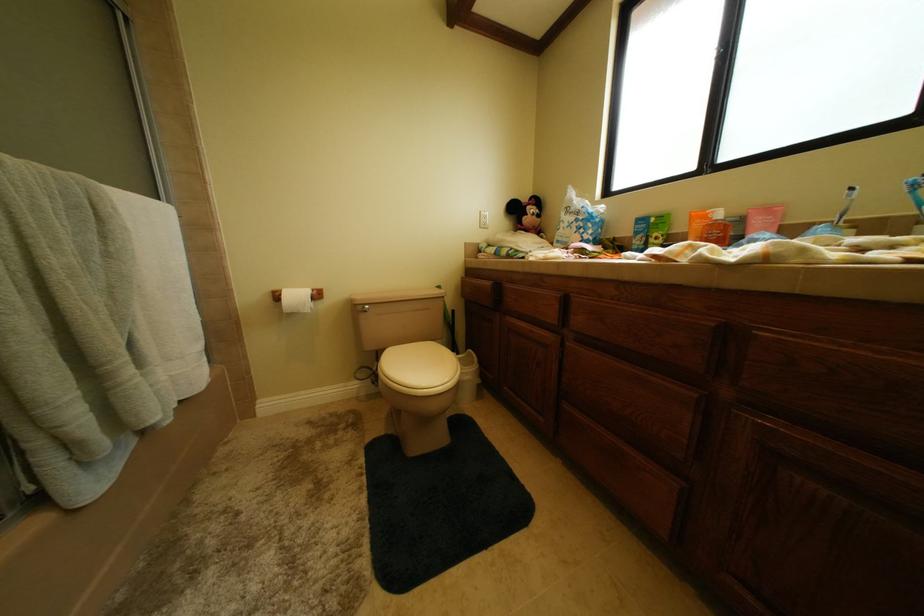
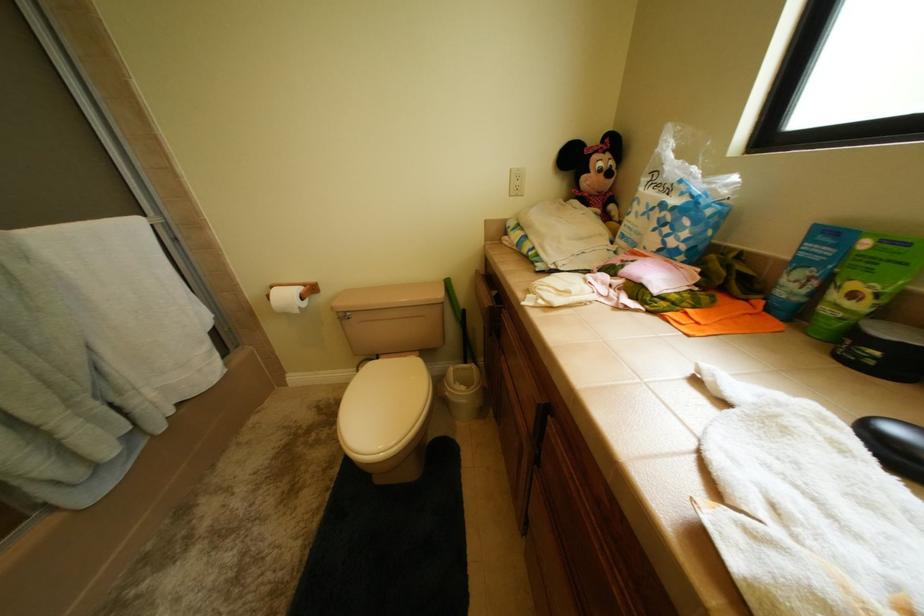
Consider the image. The images are taken continuously from a first-person perspective. In which direction are you moving?

The movement direction of the cameraman is right, forward.